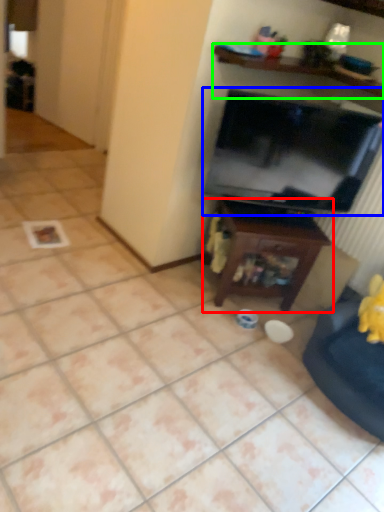
Question: Which object is positioned farthest from table (highlighted by a red box)? Select from television (highlighted by a blue box) and shelf (highlighted by a green box).

Choices:
 (A) television
 (B) shelf

Answer: (B)